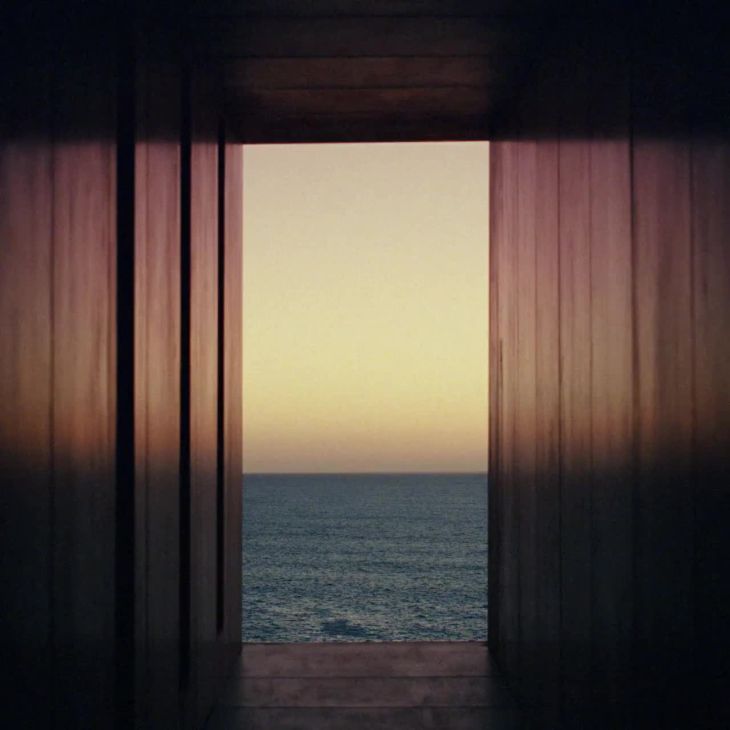
I want to click on left side of wall, so click(x=47, y=328).